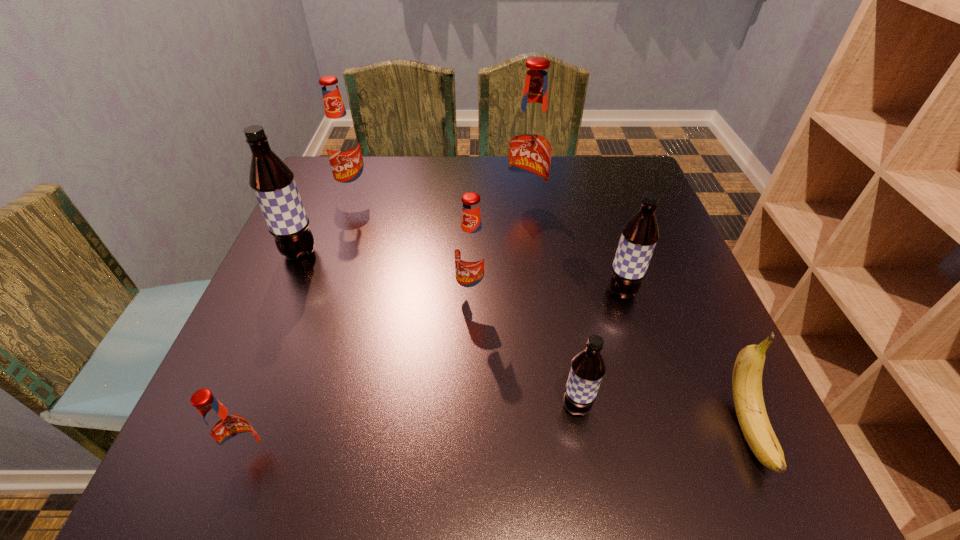
The height and width of the screenshot is (540, 960). In the image, there is a desktop. In order to click on vacant region at the near edge in this screenshot , I will do `click(543, 481)`.

In the image, there is a desktop. Identify the location of vacant space at the left edge. (308, 347).

The image size is (960, 540). In order to click on vacant area at the right edge of the desktop in this screenshot , I will do `click(712, 320)`.

You are a GUI agent. You are given a task and a screenshot of the screen. Output one action in this format:
    pyautogui.click(x=<x>, y=<y>)
    Task: Click on the vacant space at the far left corner of the desktop
    The image size is (960, 540).
    Given the screenshot: What is the action you would take?
    pyautogui.click(x=319, y=192)

This screenshot has height=540, width=960. In order to click on free region at the near left corner in this screenshot , I will do `click(281, 438)`.

Locate an element on the screen. The height and width of the screenshot is (540, 960). vacant space at the far right corner of the desktop is located at coordinates (595, 158).

Locate an element on the screen. free space between the smallest red root beer and the second biggest red root beer is located at coordinates (303, 326).

Image resolution: width=960 pixels, height=540 pixels. I want to click on free space between the sixth nearest object and the rightmost red root beer, so click(413, 231).

Identify the location of free spot between the second biggest red root beer and the rightmost root beer. (488, 243).

Image resolution: width=960 pixels, height=540 pixels. In order to click on free area in between the leftmost brown root beer and the rightmost red root beer in this screenshot , I will do `click(413, 231)`.